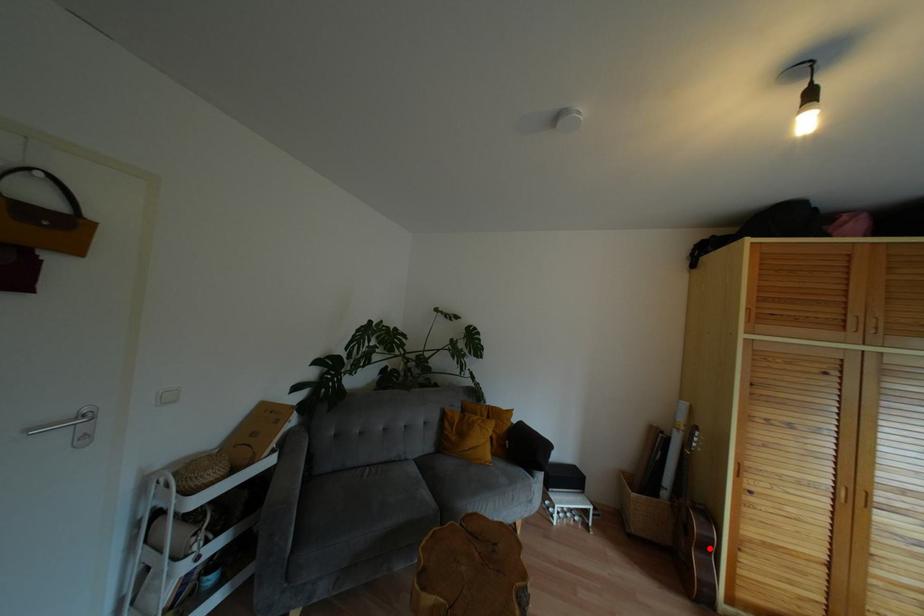
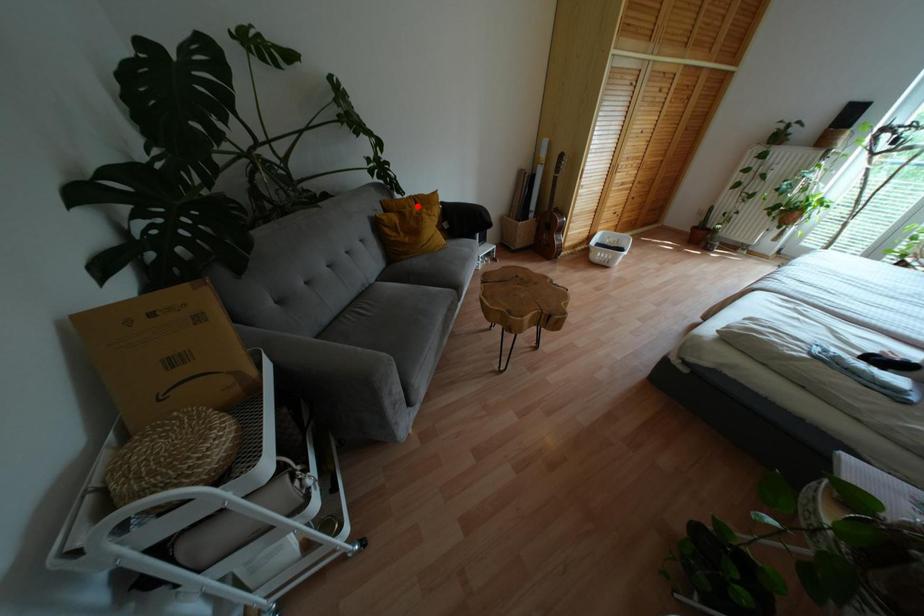
I am providing you with two images of the same scene from different viewpoints. A red point is marked on the first image and another point is marked on the second image. Is the marked point in image1 the same physical position as the marked point in image2?

No